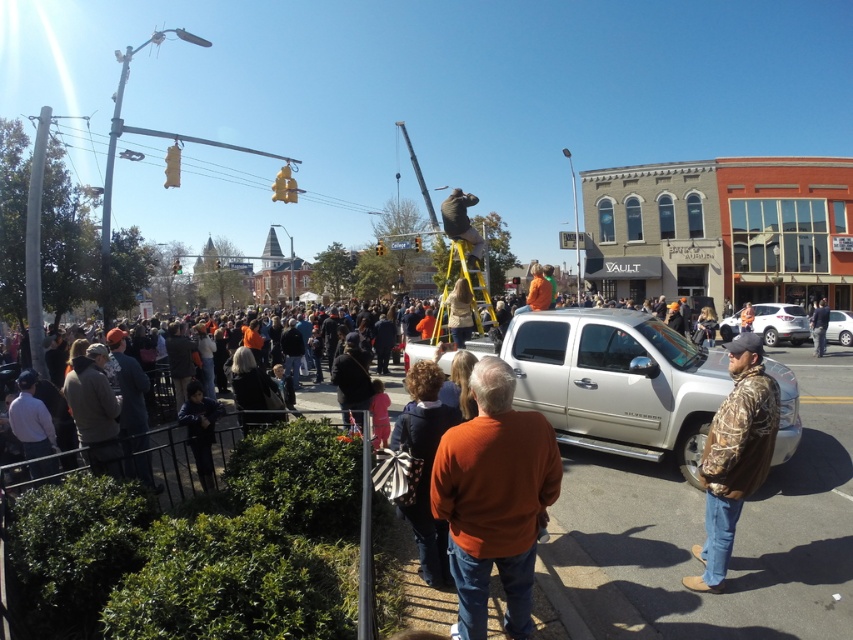
Question: Which of the following is the farthest from the observer?

Choices:
 (A) (444, 212)
 (B) (523, 589)
 (C) (448, 273)
 (D) (781, 310)

Answer: (C)

Question: Can you confirm if camo jacket at center is smaller than camouflage jacket at lower right?

Choices:
 (A) no
 (B) yes

Answer: (B)

Question: Which of the following is the farthest from the observer?

Choices:
 (A) (474, 232)
 (B) (514, 540)
 (C) (819, 326)

Answer: (C)

Question: Which object is farther from the camera taking this photo?

Choices:
 (A) orange sweater at center
 (B) camouflage jacket at lower right

Answer: (B)

Question: Where is orange fabric crowd at lower left located in relation to matte brown bear at center in the image?

Choices:
 (A) above
 (B) below

Answer: (B)

Question: Is orange sweater at center smaller than matte brown bear at center?

Choices:
 (A) no
 (B) yes

Answer: (B)